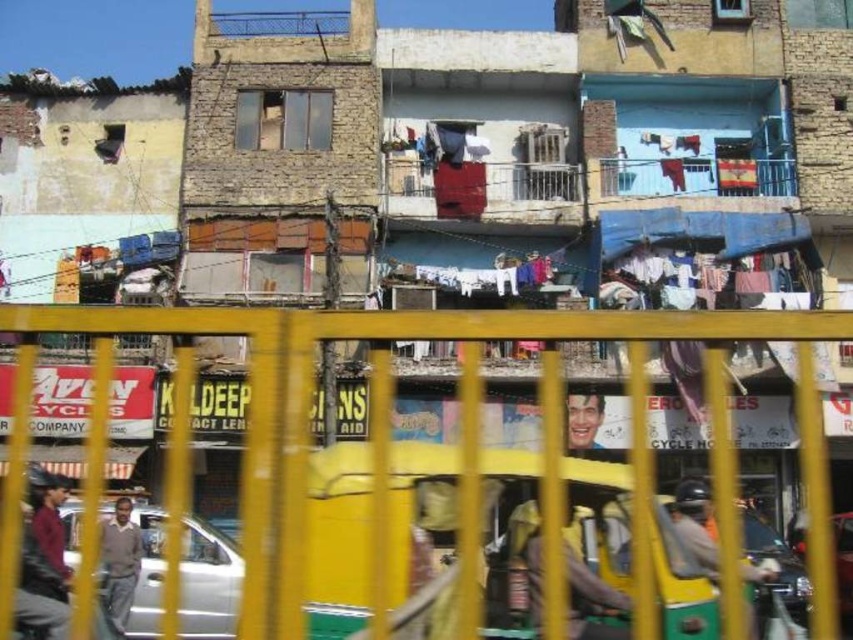
You are a delivery person trying to navigate through a narrow alleyway. You see a yellow metal fence at center and a silver metallic car at lower left. Which object is wider, potentially affecting your path?

The yellow metal fence at center might be wider than silver metallic car at lower left, so it could be the wider object affecting your path.

You are a pedestrian trying to cross the street behind the yellow metal railing. You see the silver metallic car at lower left and the shiny silver car at center. Which car is closer to you?

The silver metallic car at lower left is closer to you because it is positioned over the shiny silver car at center, indicating it is in front.

You are a drone operator trying to capture a photo of the urban scene. Your drone is currently at the yellow metal fence at center. To get a clear shot, you need to move the drone 0.3 units to the right and 0.2 units up. What will be the new coordinates of the drone?

The new coordinates will be calculated by adding 0.3 to the x coordinate and 0.2 to the y coordinate of the yellow metal fence at center. The original coordinates are 0.681 and 0.456. Adding 0.3 to 0.681 gives 0.981, and adding 0.2 to 0.456 gives 0.656. Therefore, the new coordinates are (x=559, y=627).